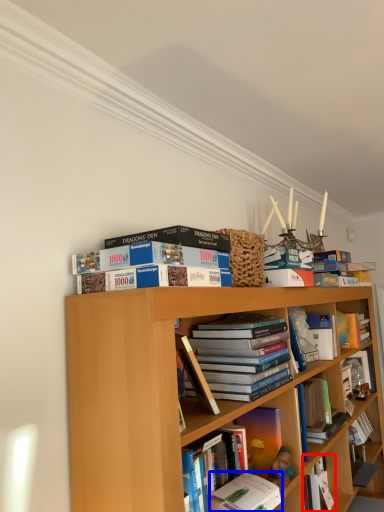
Question: Which object is further to the camera taking this photo, book (highlighted by a red box) or book (highlighted by a blue box)?

Choices:
 (A) book
 (B) book

Answer: (A)